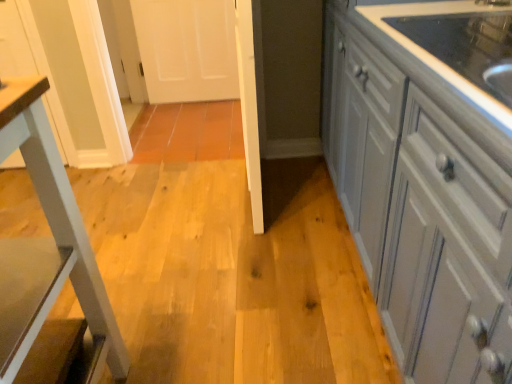
This screenshot has width=512, height=384. Describe the element at coordinates (47, 244) in the screenshot. I see `white glossy table leg at left` at that location.

Locate an element on the screen. white glossy table leg at left is located at coordinates (47, 244).

Identify the location of white glossy cabinets at right. The height and width of the screenshot is (384, 512). (426, 177).

From the picture: In order to face white glossy cabinets at right, should I rotate leftwards or rightwards?

Rotate right and turn 28.467 degrees.

The image size is (512, 384). What do you see at coordinates (426, 177) in the screenshot? I see `white glossy cabinets at right` at bounding box center [426, 177].

Where is `white glossy table leg at left`? The width and height of the screenshot is (512, 384). white glossy table leg at left is located at coordinates 47,244.

Which object is positioned more to the left, white glossy table leg at left or white glossy cabinets at right?

Positioned to the left is white glossy table leg at left.

Does white glossy table leg at left come behind white glossy cabinets at right?

That is True.

Between point (16, 137) and point (327, 41), which one is positioned behind?

The point (327, 41) is farther from the camera.

From the image's perspective, who appears lower, white glossy table leg at left or white glossy cabinets at right?

white glossy table leg at left appears lower in the image.

From a real-world perspective, between white glossy table leg at left and white glossy cabinets at right, who is vertically higher?

white glossy table leg at left.

Is white glossy table leg at left wider than white glossy cabinets at right?

In fact, white glossy table leg at left might be narrower than white glossy cabinets at right.

Is white glossy table leg at left taller than white glossy cabinets at right?

In fact, white glossy table leg at left may be shorter than white glossy cabinets at right.

Is white glossy table leg at left bigger than white glossy cabinets at right?

Incorrect, white glossy table leg at left is not larger than white glossy cabinets at right.

Would you say white glossy table leg at left is outside white glossy cabinets at right?

white glossy table leg at left is positioned outside white glossy cabinets at right.

Are white glossy table leg at left and white glossy cabinets at right beside each other?

No, white glossy table leg at left is not making contact with white glossy cabinets at right.

Could you tell me if white glossy table leg at left is turned towards white glossy cabinets at right?

No, white glossy table leg at left is not facing towards white glossy cabinets at right.

Can you tell me how much white glossy table leg at left and white glossy cabinets at right differ in facing direction?

90.7 degrees.

Image resolution: width=512 pixels, height=384 pixels. Identify the location of furniture on the left of white glossy cabinets at right. (47, 244).

Is white glossy cabinets at right to the left or to the right of white glossy table leg at left in the image?

Based on their positions, white glossy cabinets at right is located to the right of white glossy table leg at left.

Is white glossy cabinets at right in front of or behind white glossy table leg at left in the image?

In the image, white glossy cabinets at right appears in front of white glossy table leg at left.

Does point (402, 53) appear closer or farther from the camera than point (61, 275)?

Point (402, 53) is positioned closer to the camera compared to point (61, 275).

From the image's perspective, is white glossy cabinets at right positioned above or below white glossy table leg at left?

Clearly, from the image's perspective, white glossy cabinets at right is above white glossy table leg at left.

From a real-world perspective, is white glossy cabinets at right physically located above or below white glossy table leg at left?

Clearly, from a real-world perspective, white glossy cabinets at right is below white glossy table leg at left.

Is white glossy cabinets at right thinner than white glossy table leg at left?

Incorrect, the width of white glossy cabinets at right is not less than that of white glossy table leg at left.

Is white glossy cabinets at right taller or shorter than white glossy table leg at left?

In the image, white glossy cabinets at right appears to be taller than white glossy table leg at left.

Can you confirm if white glossy cabinets at right is smaller than white glossy table leg at left?

No, white glossy cabinets at right is not smaller than white glossy table leg at left.

Is white glossy cabinets at right not within white glossy table leg at left?

Indeed, white glossy cabinets at right is completely outside white glossy table leg at left.

Are white glossy cabinets at right and white glossy table leg at left making contact?

white glossy cabinets at right and white glossy table leg at left are clearly separated.

Is white glossy cabinets at right oriented away from white glossy table leg at left?

No, white glossy cabinets at right is not facing away from white glossy table leg at left.

Locate an element on the screen. furniture behind the white glossy cabinets at right is located at coordinates (47, 244).

This screenshot has height=384, width=512. I want to click on cabinetry in front of the white glossy table leg at left, so click(426, 177).

You are a GUI agent. You are given a task and a screenshot of the screen. Output one action in this format:
    pyautogui.click(x=<x>, y=<y>)
    Task: Click on the furniture below the white glossy cabinets at right (from the image's perspective)
    The height and width of the screenshot is (384, 512).
    Given the screenshot: What is the action you would take?
    (47, 244)